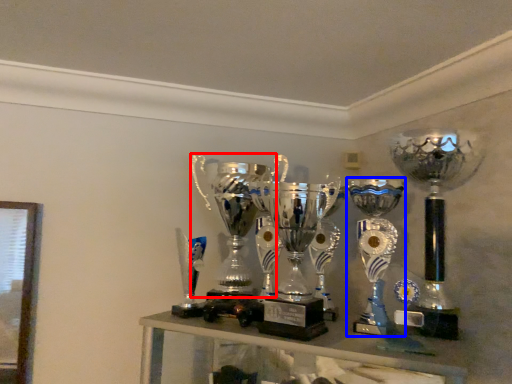
Question: Among these objects, which one is farthest to the camera, trophy (highlighted by a red box) or trophy (highlighted by a blue box)?

Choices:
 (A) trophy
 (B) trophy

Answer: (A)